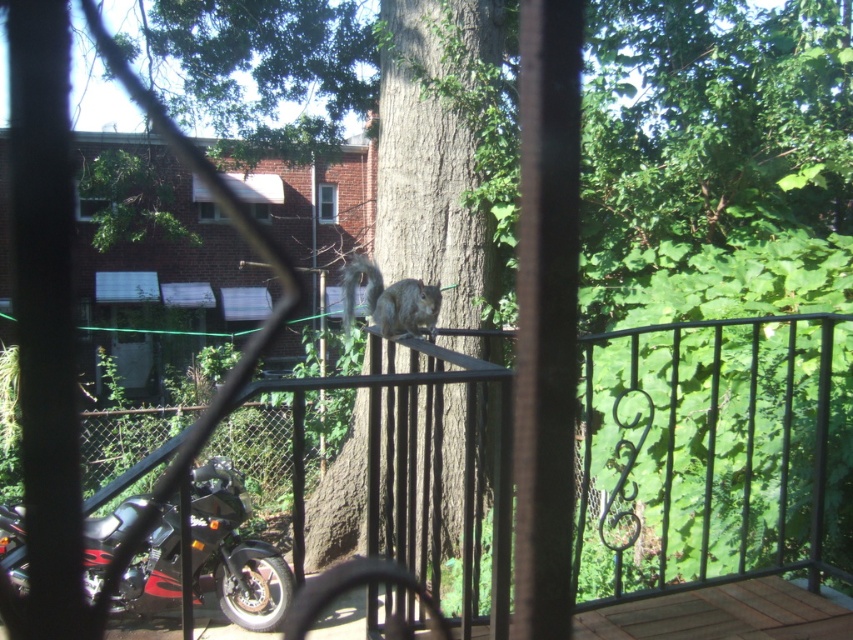
Does fuzzy gray squirrel at center have a greater width compared to transparent plastic screen door at lower left?

No.

Can you confirm if fuzzy gray squirrel at center is thinner than transparent plastic screen door at lower left?

Yes, fuzzy gray squirrel at center is thinner than transparent plastic screen door at lower left.

I want to click on fuzzy gray squirrel at center, so click(x=390, y=300).

Where is `fuzzy gray squirrel at center`? The image size is (853, 640). fuzzy gray squirrel at center is located at coordinates (390, 300).

Between black matte motorcycle at lower left and fuzzy gray squirrel at center, which one appears on the left side from the viewer's perspective?

Positioned to the left is black matte motorcycle at lower left.

Which is behind, point (198, 579) or point (373, 285)?

The point (198, 579) is behind.

This screenshot has width=853, height=640. I want to click on black matte motorcycle at lower left, so click(234, 552).

This screenshot has height=640, width=853. I want to click on black matte motorcycle at lower left, so click(234, 552).

Between point (833, 412) and point (169, 548), which one is positioned behind?

The point (169, 548) is more distant.

At what (x,y) coordinates should I click in order to perform the action: click on black wrought iron fence at center. Please return your answer as a coordinate pair (x, y). This screenshot has width=853, height=640. Looking at the image, I should click on (717, 445).